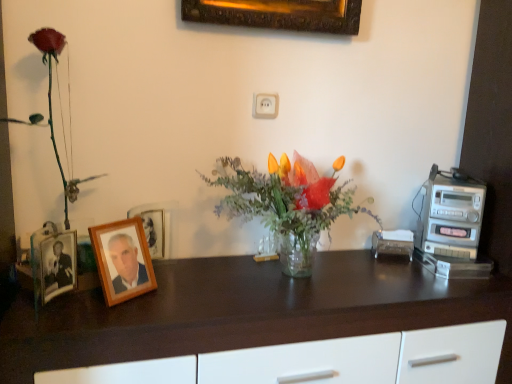
Find the location of a particular element. This screenshot has height=384, width=512. vacant area to the left of silver metallic stereo at right is located at coordinates (395, 269).